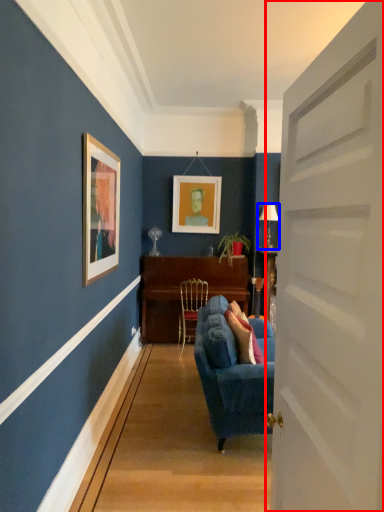
Question: Which object appears closest to the camera in this image, door (highlighted by a red box) or lamp (highlighted by a blue box)?

Choices:
 (A) door
 (B) lamp

Answer: (A)